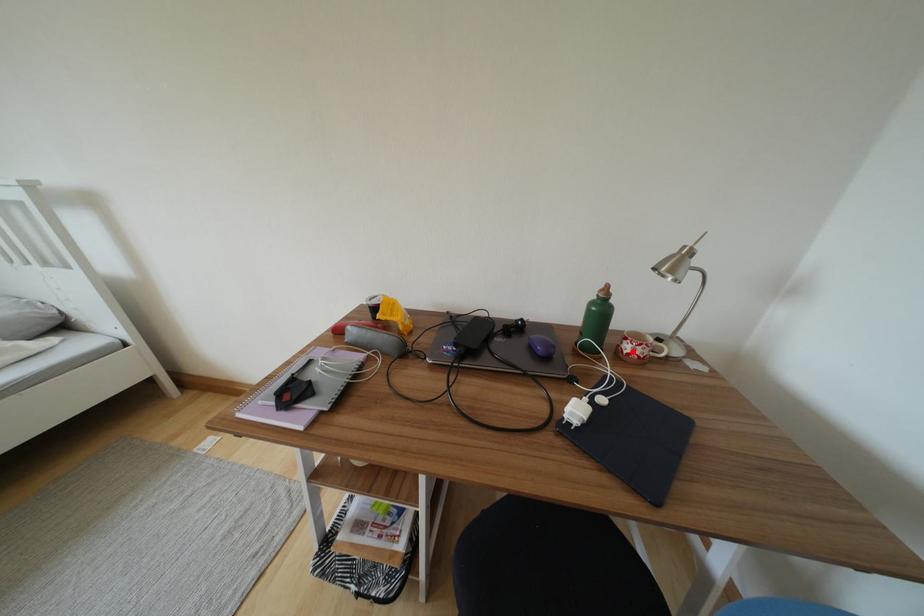
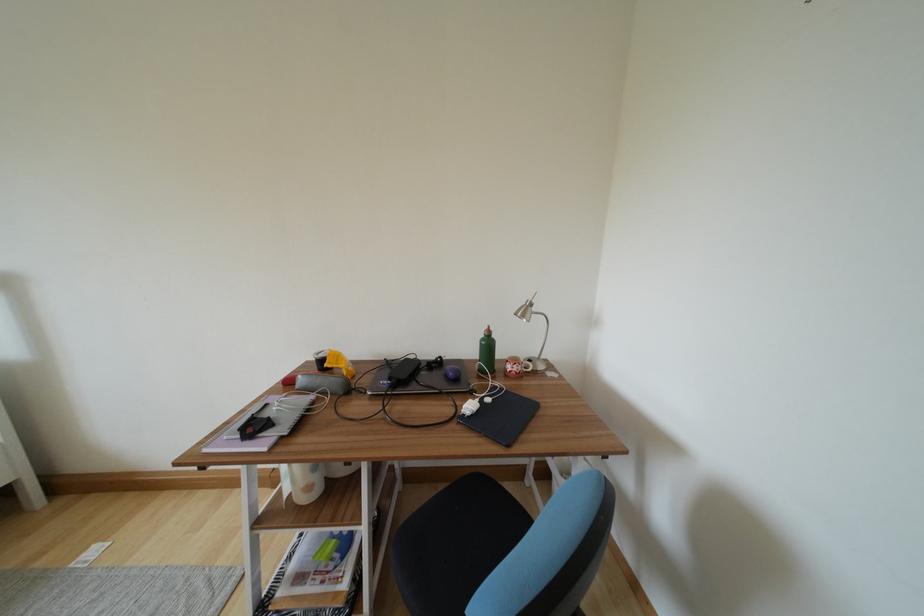
Find the pixel in the second image that matches the highlighted location in the first image.

(514, 371)